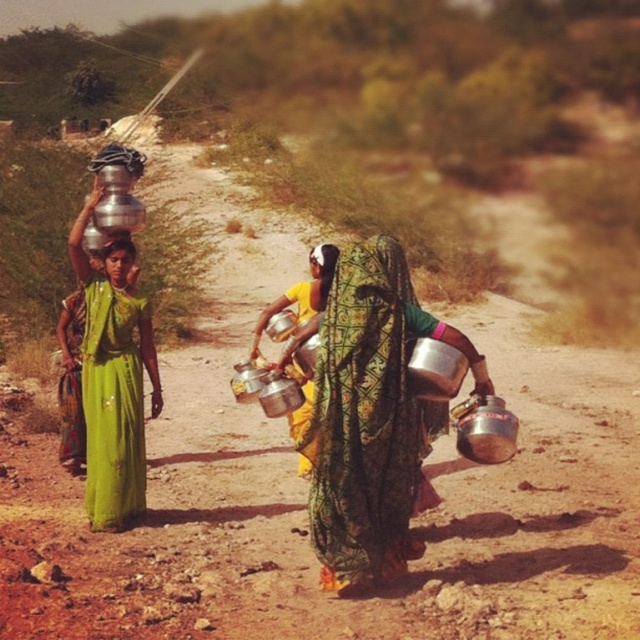
Question: Is matte silver water at left above matte green dress at center?

Choices:
 (A) no
 (B) yes

Answer: (A)

Question: Which point appears closest to the camera in this image?

Choices:
 (A) (330, 484)
 (B) (161, 403)
 (C) (116, 276)
 (D) (321, 250)

Answer: (A)

Question: Which of the following is the closest to the observer?

Choices:
 (A) matte silver water at left
 (B) shiny metallic pot at center
 (C) matte green dress at center

Answer: (B)

Question: Does matte green dress at center lie behind matte black hair at center?

Choices:
 (A) no
 (B) yes

Answer: (B)

Question: Which object is closer to the camera taking this photo?

Choices:
 (A) matte black hair at center
 (B) matte silver water at left

Answer: (A)

Question: Does matte silver water at left appear over matte green dress at center?

Choices:
 (A) yes
 (B) no

Answer: (B)